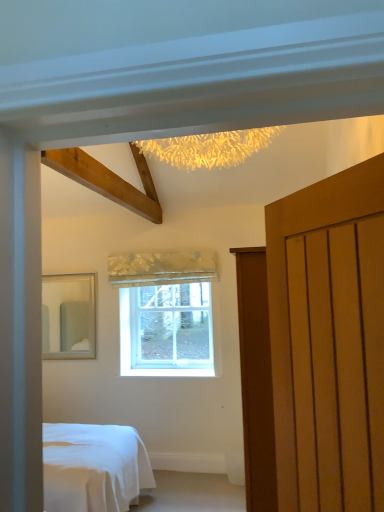
At what (x,y) coordinates should I click in order to perform the action: click on free spot above silky gold curtain at center (from a real-world perspective). Please return your answer as a coordinate pair (x, y). The image size is (384, 512). Looking at the image, I should click on (168, 249).